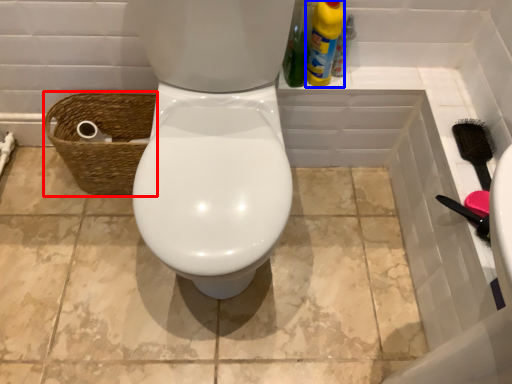
Question: Which object appears farthest to the camera in this image, basket (highlighted by a red box) or cleaning product (highlighted by a blue box)?

Choices:
 (A) basket
 (B) cleaning product

Answer: (A)